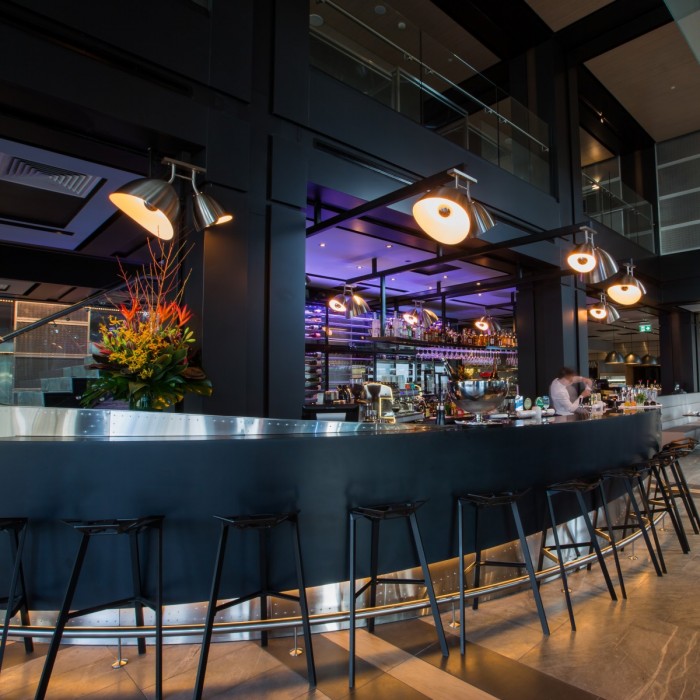
Where is `drink glasses`? drink glasses is located at coordinates (644, 396).